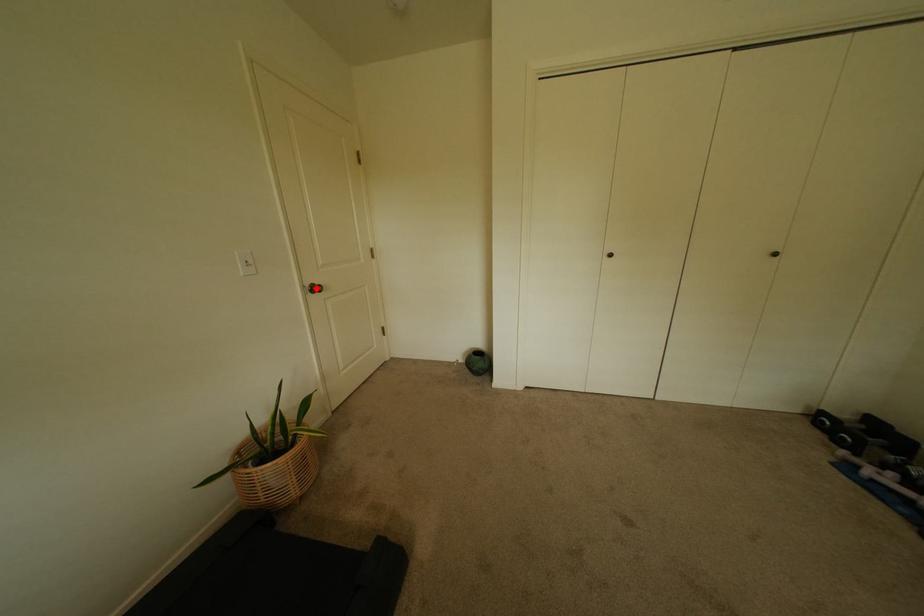
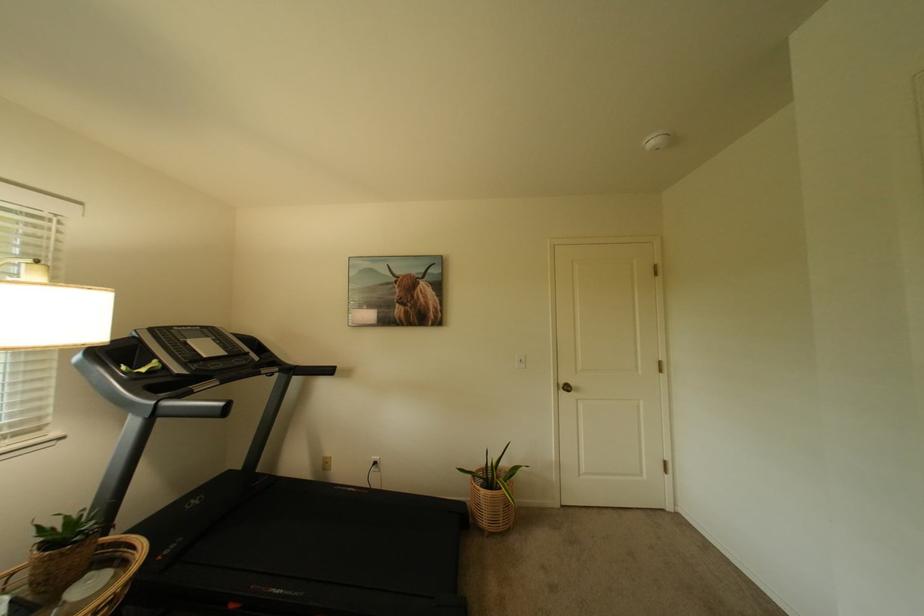
Question: I am providing you with two images of the same scene from different viewpoints. A red point is marked on the first image. Can you still see the location of the red point in image 2?

Choices:
 (A) Yes
 (B) No

Answer: (A)